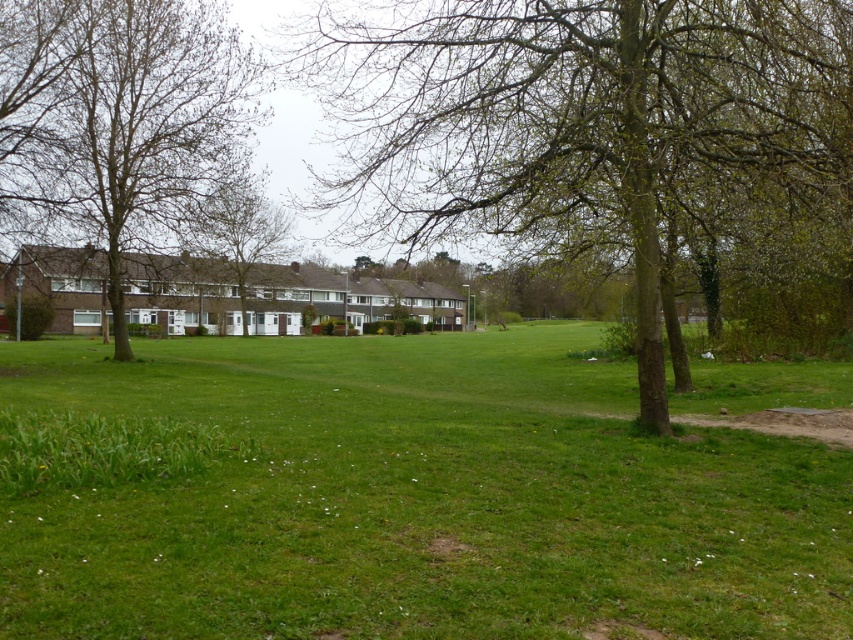
You are a gardener planning to plant a new tree in the suburban scene. You have two options for placement based on existing trees. The brown rough tree at center and the brown leafless tree at left. Which tree has a wider trunk? Please choose between the two based on their widths.

The brown rough tree at center has a wider trunk than the brown leafless tree at left because its width surpasses the latter.

You are standing in the suburban scene and want to place a small garden ornament. You have two options for placement locations marked as point 1 at coordinates point (276, 579) and point 2 at coordinates point (154, 240). Which point is closer to you?

Point (276, 579) is closer to the camera than point (154, 240), so the ornament placed there would be nearer to your current position.

You are standing at the point marked by coordinates point (416,499) in the suburban scene. What is the immediate surface you are standing on?

The point (416,499) marks green grassy field at center, so you are standing on the green grassy field at center.